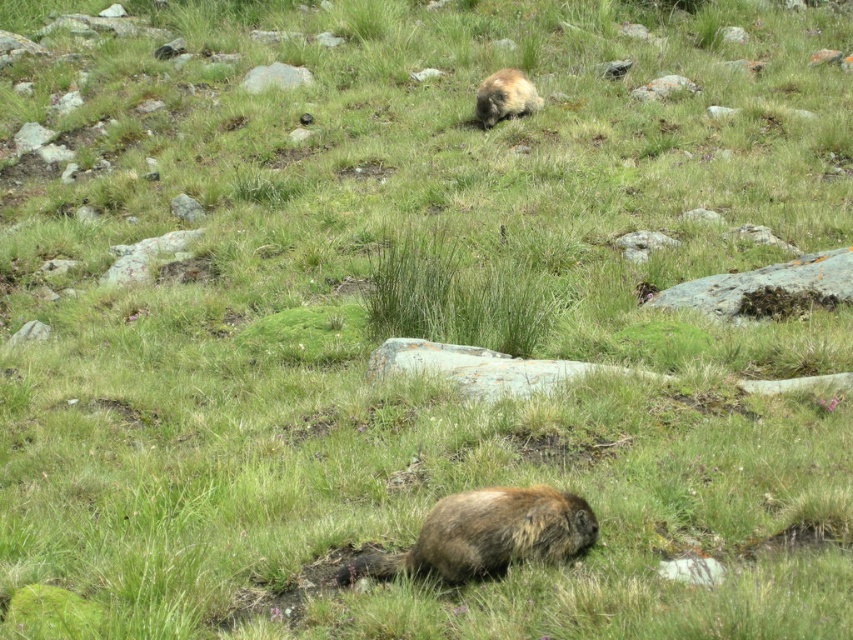
Question: Is gray rough rock at right thinner than fuzzy brown animal at upper center?

Choices:
 (A) yes
 (B) no

Answer: (B)

Question: In this image, where is gray rough rock at right located relative to gray rock at upper center?

Choices:
 (A) below
 (B) above

Answer: (A)

Question: Considering the real-world distances, which object is closest to the gray rock at upper center?

Choices:
 (A) brown furry groundhog at lower center
 (B) gray rough rock at right
 (C) fuzzy brown animal at upper center

Answer: (C)

Question: Which is nearer to the brown furry groundhog at lower center?

Choices:
 (A) gray rough rock at right
 (B) fuzzy brown animal at upper center
 (C) gray rock at upper center

Answer: (A)

Question: Estimate the real-world distances between objects in this image. Which object is farther from the gray rough rock at right?

Choices:
 (A) gray rock at upper center
 (B) fuzzy brown animal at upper center

Answer: (A)

Question: Can you confirm if brown furry groundhog at lower center is thinner than gray rough rock at right?

Choices:
 (A) yes
 (B) no

Answer: (A)